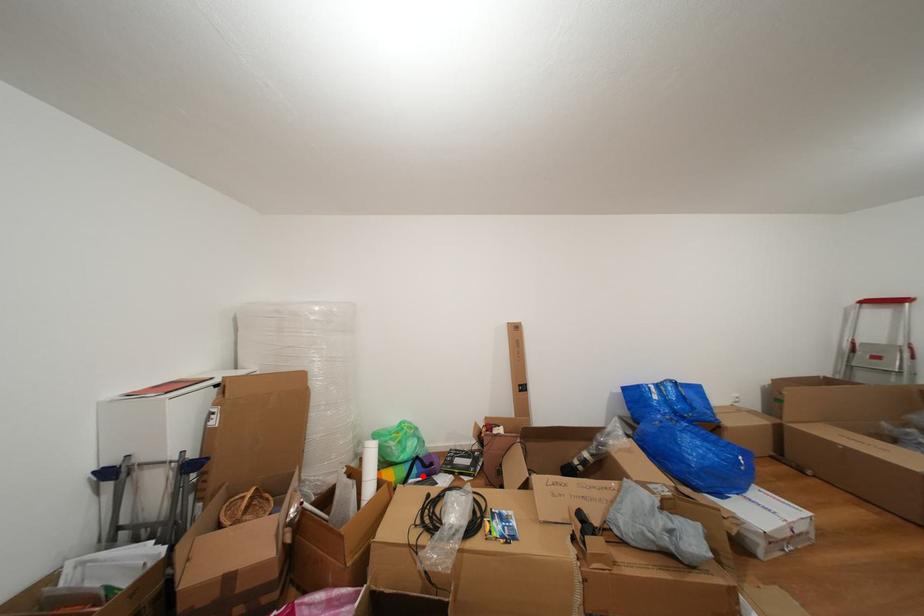
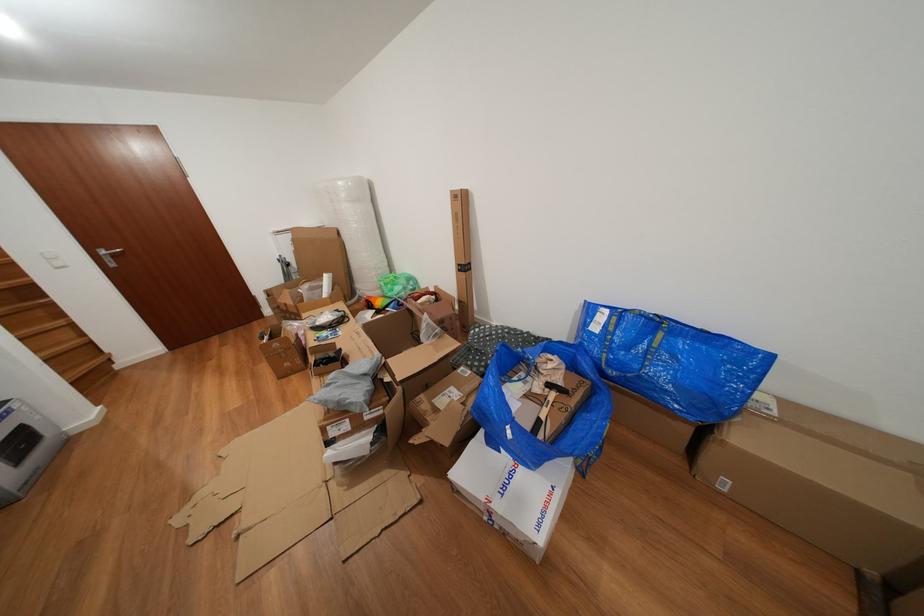
The point at the highlighted location is marked in the first image. Where is the corresponding point in the second image?

(399, 310)